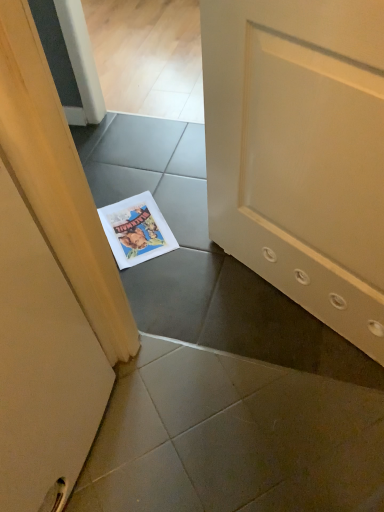
Question: Does point (33, 443) appear closer or farther from the camera than point (119, 223)?

Choices:
 (A) farther
 (B) closer

Answer: (B)

Question: Considering the positions of wooden door at left and white paper comic book at center in the image, is wooden door at left wider or thinner than white paper comic book at center?

Choices:
 (A) wide
 (B) thin

Answer: (A)

Question: In the image, is wooden door at left positioned in front of or behind white paper comic book at center?

Choices:
 (A) behind
 (B) front

Answer: (B)

Question: In terms of width, does white paper comic book at center look wider or thinner when compared to wooden door at left?

Choices:
 (A) wide
 (B) thin

Answer: (B)

Question: In terms of height, does white paper comic book at center look taller or shorter compared to wooden door at left?

Choices:
 (A) short
 (B) tall

Answer: (A)

Question: From the image's perspective, relative to wooden door at left, is white paper comic book at center above or below?

Choices:
 (A) above
 (B) below

Answer: (A)

Question: Relative to wooden door at left, is white paper comic book at center in front or behind?

Choices:
 (A) front
 (B) behind

Answer: (B)